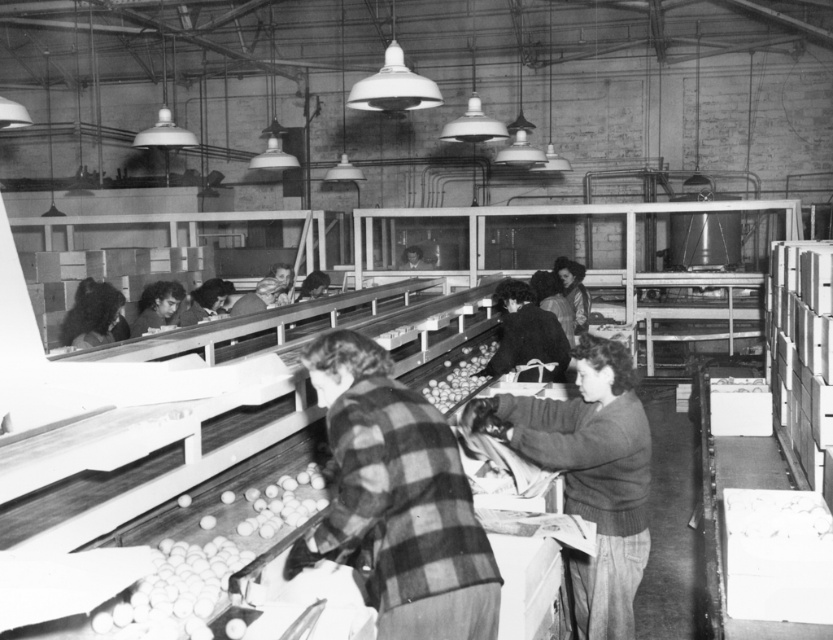
You are standing at the entrance of the factory and see two points marked in the scene. Which point is closer to you, point (487,586) or point (472,376)?

Point (487,586) is in front of point (472,376), so it is closer to you.

You are an inspector in the factory and need to determine which worker is closer to the conveyor belt. The workers are wearing a checkered fabric shirt at center and a plaid shirt at center. Based on their positions, which worker is closer to the conveyor belt?

The checkered fabric shirt at center is closer to the conveyor belt because it occupies less space than the plaid shirt at center, indicating proximity.

You are a maintenance worker in the factory. You need to reach a control panel located 3 meters away from the checkered fabric shirt at center. Can you reach it without moving past the plaid shirt at center?

The checkered fabric shirt at center and plaid shirt at center are 3.09 meters apart. Since the control panel is 3 meters away from the checkered fabric shirt at center, you can reach it without moving past the plaid shirt at center because the distance between them is slightly more than needed.